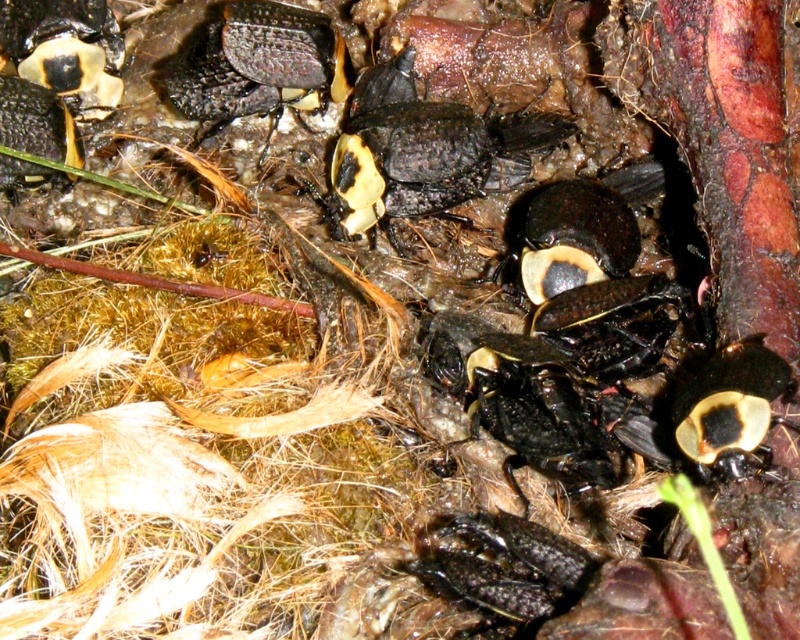
Locate an element on the screen. matte black beetle at center is located at coordinates (422, 154).

Based on the photo, can you confirm if matte black beetle at center is positioned above shiny black beetle at upper center?

No, matte black beetle at center is not above shiny black beetle at upper center.

Where is `matte black beetle at center`? matte black beetle at center is located at coordinates (422, 154).